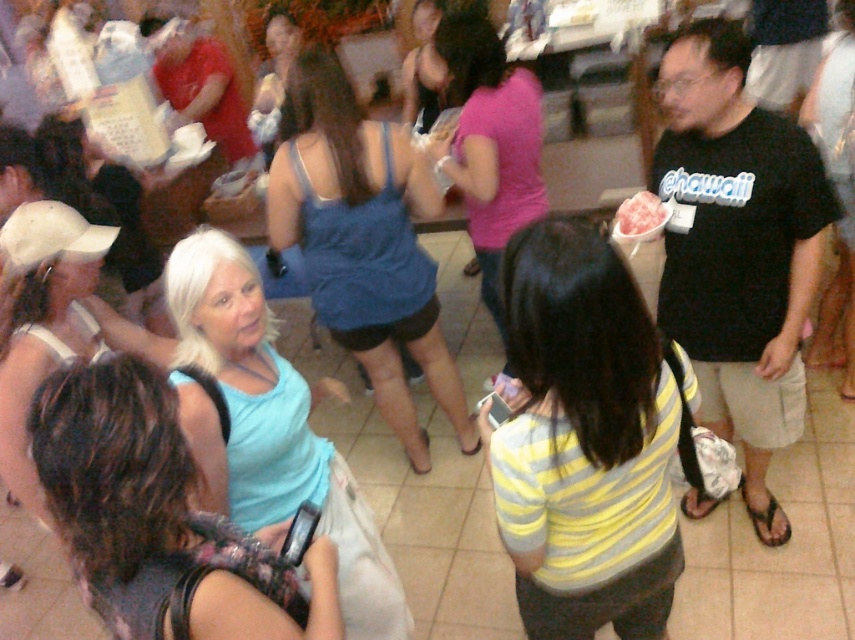
Looking at this image, is matte blue tank top at center thinner than pink frosted cake at center?

Incorrect, matte blue tank top at center's width is not less than pink frosted cake at center's.

Is point (500, 204) less distant than point (640, 192)?

Yes, it is in front of point (640, 192).

Locate an element on the screen. This screenshot has height=640, width=855. matte blue tank top at center is located at coordinates (487, 138).

Which is behind, point (609, 426) or point (444, 20)?

Positioned behind is point (444, 20).

Is striped cotton shirt at center further to camera compared to matte blue tank top at center?

No.

Which is in front, point (581, 333) or point (522, 177)?

Point (581, 333) is in front.

Locate an element on the screen. The image size is (855, 640). striped cotton shirt at center is located at coordinates (585, 440).

Between point (652, 429) and point (214, 310), which one is positioned in front?

Point (652, 429)

Does point (568, 625) come closer to viewer compared to point (256, 358)?

Yes, point (568, 625) is closer to viewer.

Which is behind, point (567, 451) or point (187, 298)?

Positioned behind is point (187, 298).

This screenshot has width=855, height=640. Identify the location of striped cotton shirt at center. (585, 440).